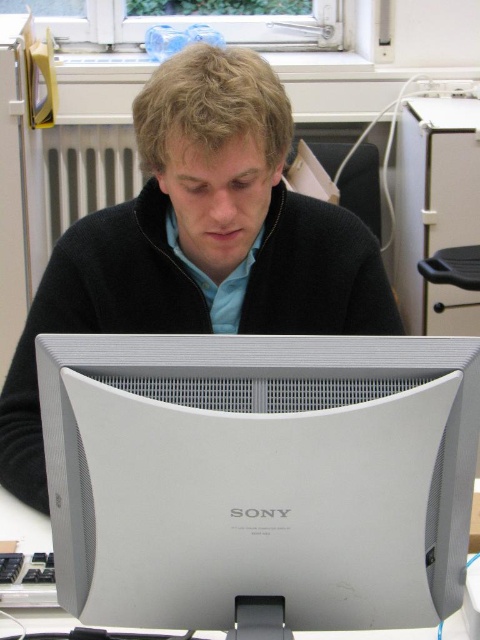
Measure the distance between satin silver monitor at center and camera.

satin silver monitor at center is 63.47 centimeters away from camera.

Can you confirm if satin silver monitor at center is shorter than black matte sweater at center?

Yes, satin silver monitor at center is shorter than black matte sweater at center.

Is point (421, 595) in front of point (54, 316)?

Yes, it is in front of point (54, 316).

Where is `satin silver monitor at center`? Image resolution: width=480 pixels, height=640 pixels. satin silver monitor at center is located at coordinates (260, 476).